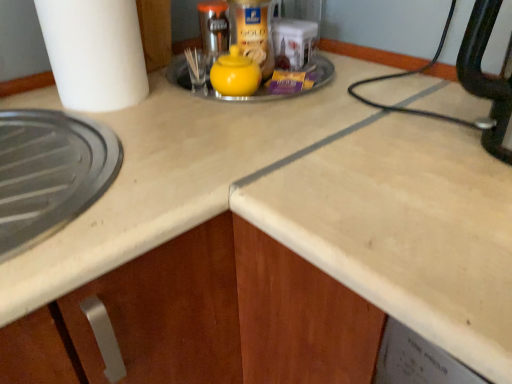
Question: From a real-world perspective, is white matte paper towel at left beneath yellow matte teapot at center?

Choices:
 (A) yes
 (B) no

Answer: (B)

Question: From the image's perspective, does white matte paper towel at left appear lower than yellow matte teapot at center?

Choices:
 (A) yes
 (B) no

Answer: (B)

Question: Does white matte paper towel at left have a lesser height compared to yellow matte teapot at center?

Choices:
 (A) yes
 (B) no

Answer: (B)

Question: Would you say white matte paper towel at left contains yellow matte teapot at center?

Choices:
 (A) no
 (B) yes

Answer: (A)

Question: Is white matte paper towel at left touching yellow matte teapot at center?

Choices:
 (A) yes
 (B) no

Answer: (B)

Question: Is white matte paper towel at left bigger or smaller than yellow matte sugar bowl at center?

Choices:
 (A) big
 (B) small

Answer: (A)

Question: Choose the correct answer: Is white matte paper towel at left inside yellow matte sugar bowl at center or outside it?

Choices:
 (A) outside
 (B) inside

Answer: (A)

Question: Is white matte paper towel at left taller or shorter than yellow matte sugar bowl at center?

Choices:
 (A) short
 (B) tall

Answer: (B)

Question: Considering the positions of point (68, 8) and point (220, 99), is point (68, 8) closer or farther from the camera than point (220, 99)?

Choices:
 (A) closer
 (B) farther

Answer: (A)

Question: In the image, is yellow matte sugar bowl at center on the left side or the right side of white matte paper towel at left?

Choices:
 (A) left
 (B) right

Answer: (B)

Question: Considering their positions, is yellow matte sugar bowl at center located in front of or behind white matte paper towel at left?

Choices:
 (A) behind
 (B) front

Answer: (A)

Question: Do you think yellow matte sugar bowl at center is within white matte paper towel at left, or outside of it?

Choices:
 (A) outside
 (B) inside

Answer: (A)

Question: From a real-world perspective, is yellow matte sugar bowl at center above or below white matte paper towel at left?

Choices:
 (A) below
 (B) above

Answer: (A)

Question: From a real-world perspective, is yellow matte teapot at center above or below white matte paper towel at left?

Choices:
 (A) above
 (B) below

Answer: (B)

Question: Based on their sizes in the image, would you say yellow matte teapot at center is bigger or smaller than white matte paper towel at left?

Choices:
 (A) big
 (B) small

Answer: (B)